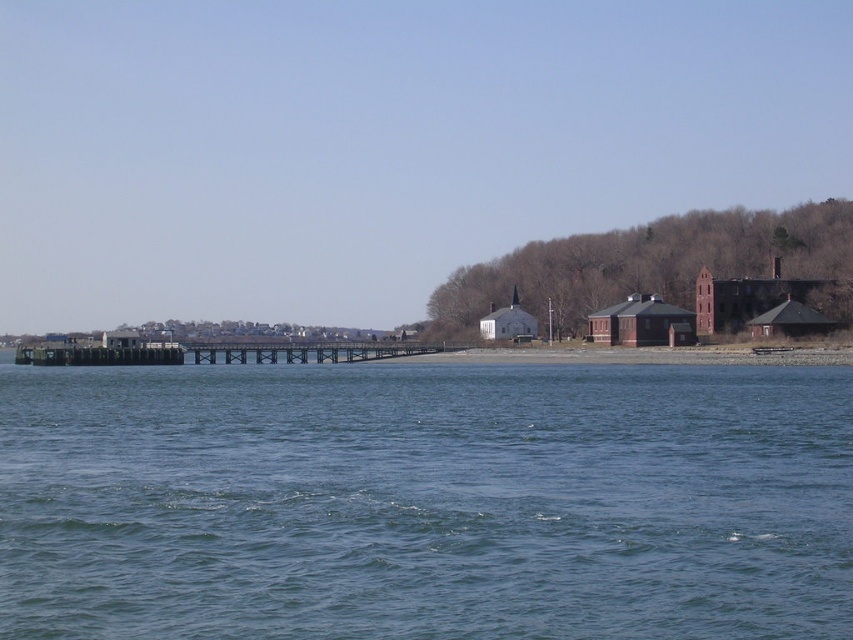
How distant is blue water at center from brown wooden dock at center?

A distance of 73.32 meters exists between blue water at center and brown wooden dock at center.

Which of these two, blue water at center or brown wooden dock at center, stands taller?

brown wooden dock at center

At what (x,y) coordinates should I click in order to perform the action: click on blue water at center. Please return your answer as a coordinate pair (x, y). The width and height of the screenshot is (853, 640). Looking at the image, I should click on (425, 500).

Find the location of `blue water at center`. blue water at center is located at coordinates (425, 500).